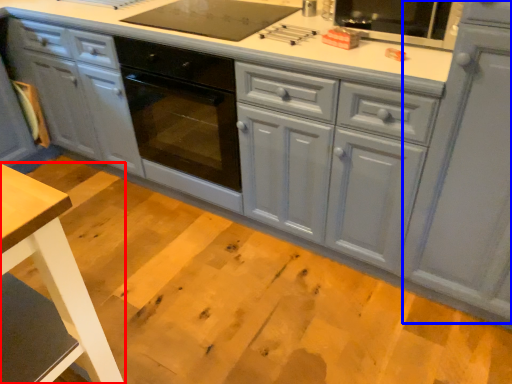
Question: Among these objects, which one is farthest to the camera, table (highlighted by a red box) or cabinetry (highlighted by a blue box)?

Choices:
 (A) table
 (B) cabinetry

Answer: (B)